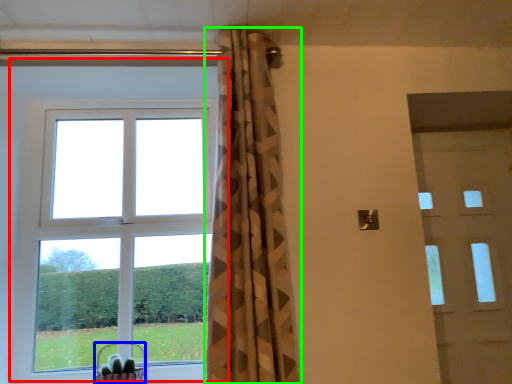
Question: Considering the real-world distances, which object is closest to window (highlighted by a red box)? basket (highlighted by a blue box) or curtain (highlighted by a green box).

Choices:
 (A) basket
 (B) curtain

Answer: (A)